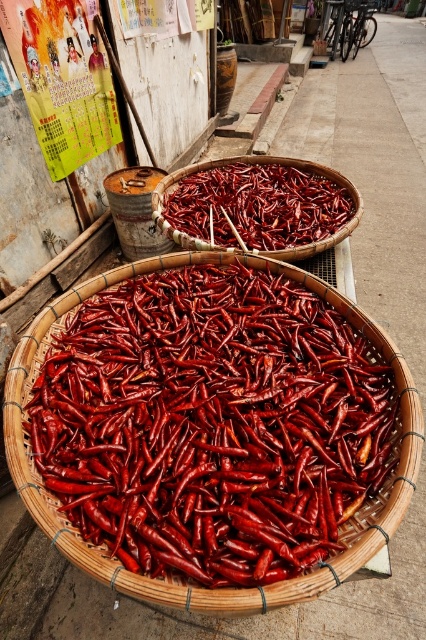
Is smooth bamboo basket at center bigger than bright red dried chili peppers at center?

Indeed, smooth bamboo basket at center has a larger size compared to bright red dried chili peppers at center.

You are a GUI agent. You are given a task and a screenshot of the screen. Output one action in this format:
    pyautogui.click(x=<x>, y=<y>)
    Task: Click on the smooth bamboo basket at center
    
    Given the screenshot: What is the action you would take?
    pyautogui.click(x=114, y=472)